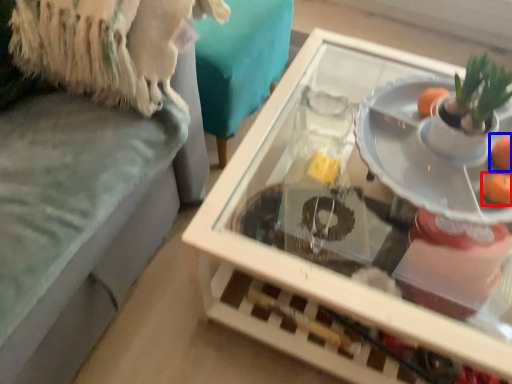
Question: Which of the following is the farthest to the observer, orange (highlighted by a red box) or orange (highlighted by a blue box)?

Choices:
 (A) orange
 (B) orange

Answer: (B)